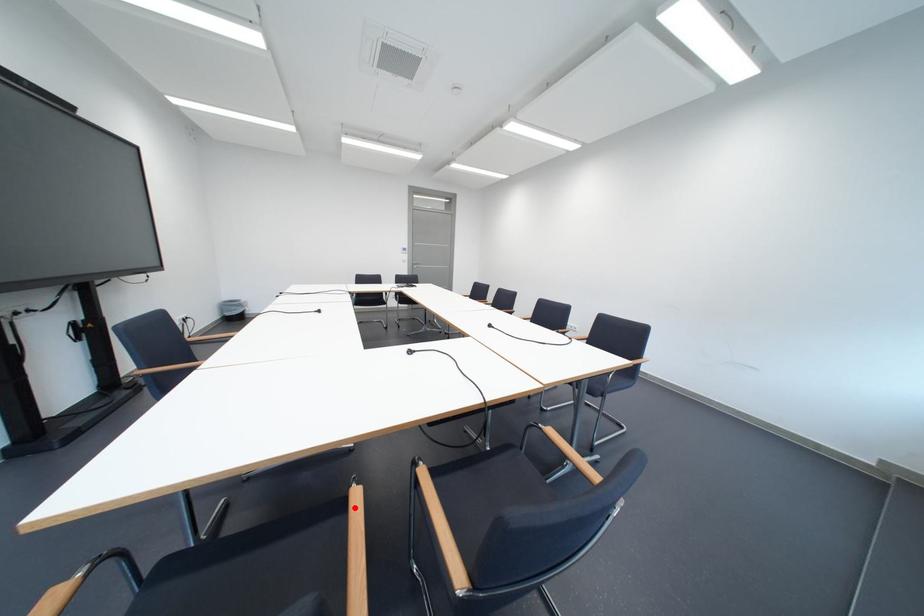
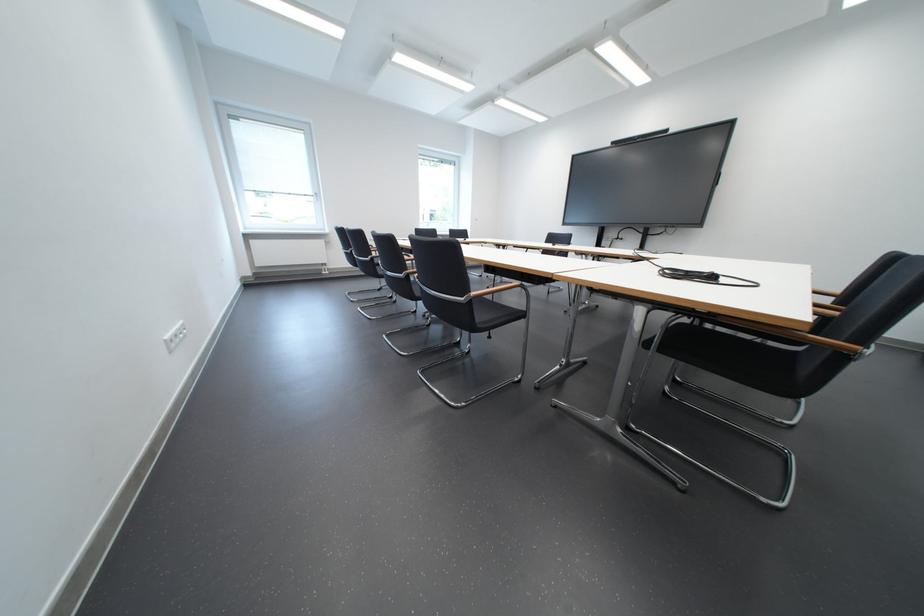
Question: I am providing you with two images of the same scene from different viewpoints. A red point is marked on the first image. Is the red point's position out of view in image 2?

Choices:
 (A) Yes
 (B) No

Answer: (A)